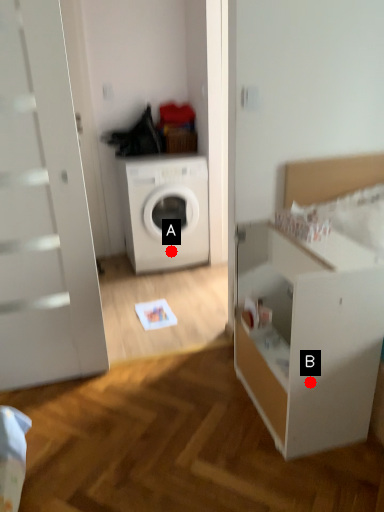
Question: Two points are circled on the image, labeled by A and B beside each circle. Which point is further to the camera?

Choices:
 (A) A is further
 (B) B is further

Answer: (A)